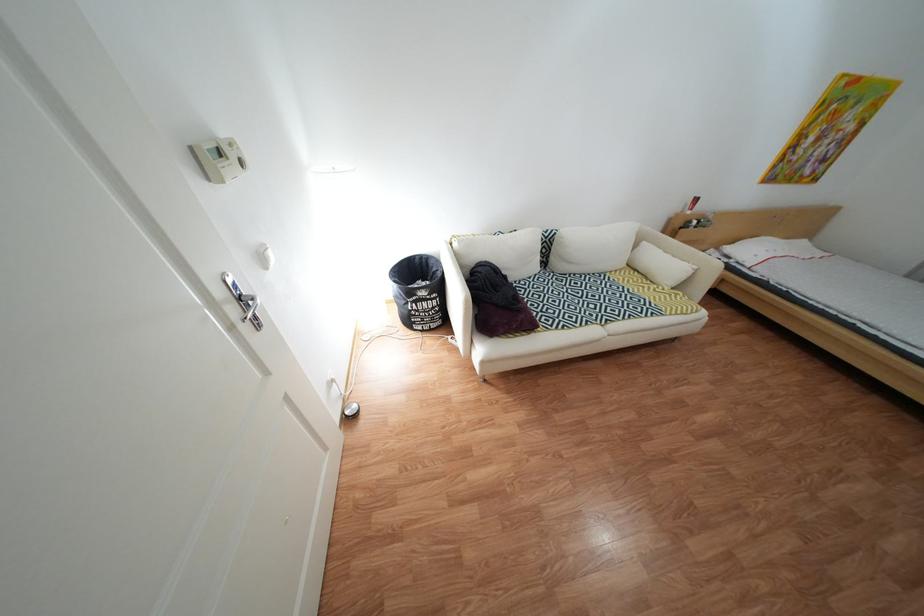
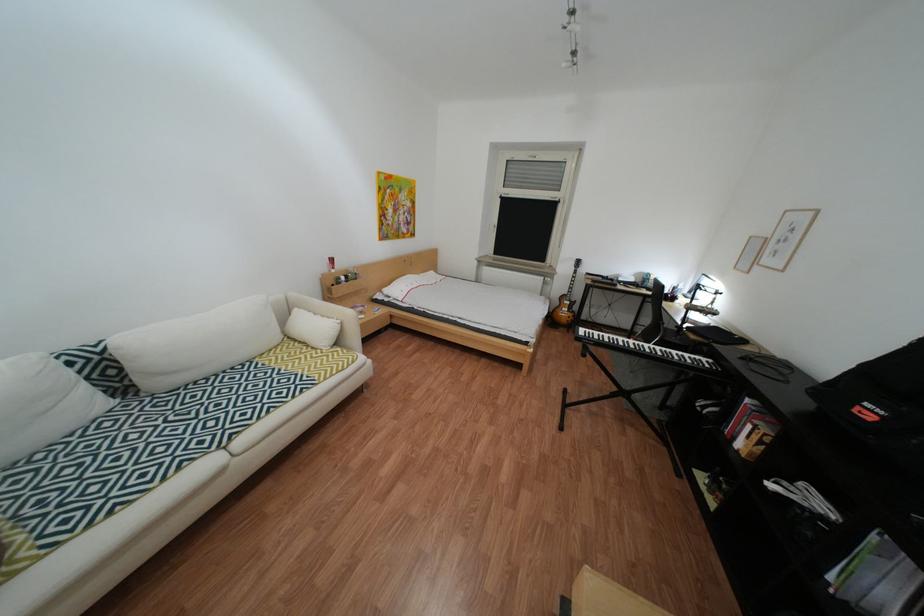
Find the pixel in the second image that matches pixel 562 236 in the first image.

(114, 351)